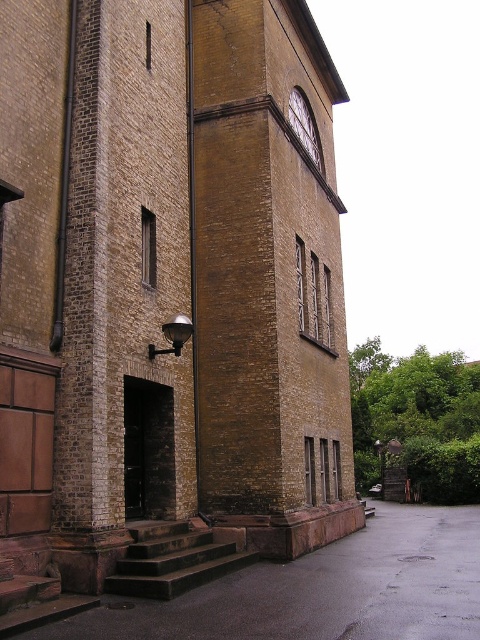
Between brown brick clock tower at center and matte brown clock at upper center, which one is positioned higher?

Positioned higher is matte brown clock at upper center.

Does brown brick clock tower at center have a lesser width compared to matte brown clock at upper center?

No.

Is point (305, 256) behind point (297, 109)?

No, (305, 256) is closer to viewer.

Locate an element on the screen. The width and height of the screenshot is (480, 640). brown brick clock tower at center is located at coordinates (267, 282).